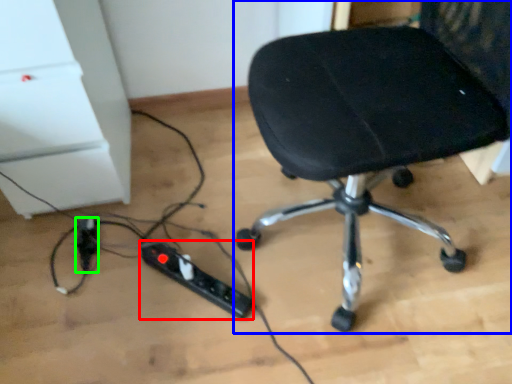
Question: Which object is the farthest from extension cord (highlighted by a red box)? Choose among these: chair (highlighted by a blue box) or extension cord (highlighted by a green box).

Choices:
 (A) chair
 (B) extension cord

Answer: (A)